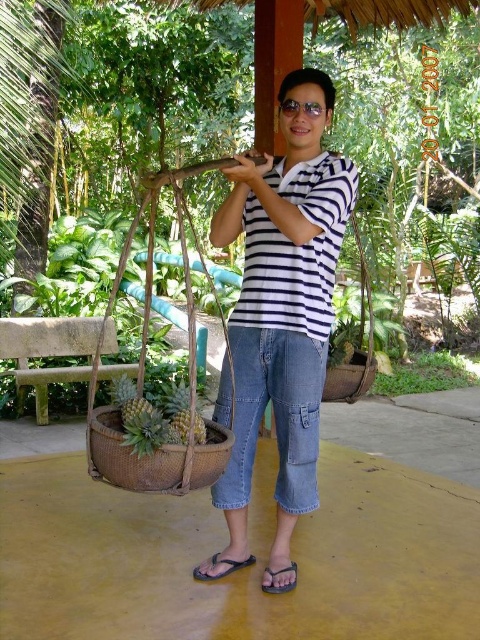
Does brown woven basket at lower right have a greater width compared to black rubber sandal at lower center?

Yes.

Does point (368, 380) come in front of point (212, 564)?

No, it is not.

Where is `brown woven basket at lower right`? brown woven basket at lower right is located at coordinates (349, 378).

Does white striped shirt at center appear on the right side of brown woven basket at lower right?

Incorrect, white striped shirt at center is not on the right side of brown woven basket at lower right.

Is white striped shirt at center shorter than brown woven basket at lower right?

Incorrect, white striped shirt at center's height does not fall short of brown woven basket at lower right's.

Locate an element on the screen. Image resolution: width=480 pixels, height=640 pixels. white striped shirt at center is located at coordinates (283, 305).

Locate an element on the screen. Image resolution: width=480 pixels, height=640 pixels. white striped shirt at center is located at coordinates (283, 305).

Can you confirm if woven brown basket at lower center is positioned to the right of brown leather sandal at lower center?

Incorrect, woven brown basket at lower center is not on the right side of brown leather sandal at lower center.

Is woven brown basket at lower center thinner than brown leather sandal at lower center?

No.

Who is more forward, (109,468) or (263,582)?

Point (109,468) is more forward.

At what (x,y) coordinates should I click in order to perform the action: click on woven brown basket at lower center. Please return your answer as a coordinate pair (x, y). Image resolution: width=480 pixels, height=640 pixels. Looking at the image, I should click on (154, 458).